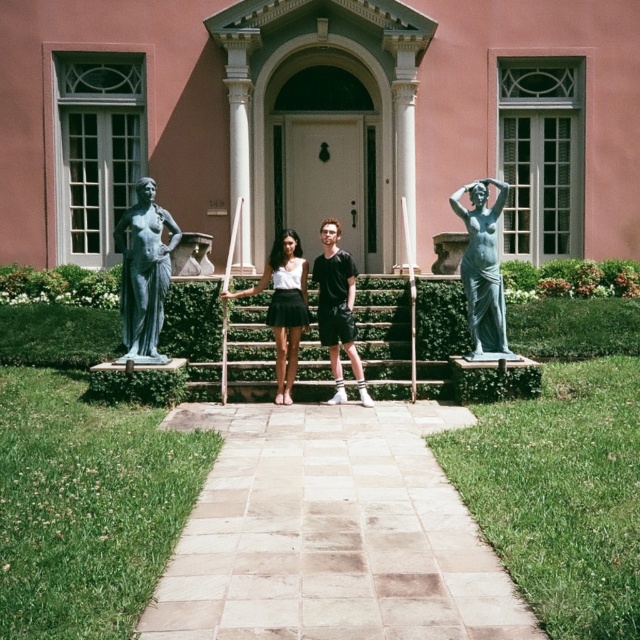
Question: Which point is closer to the camera?

Choices:
 (A) bronze statue at left
 (B) black matte shorts at center
 (C) matte green statue at right
 (D) matte white blouse at center

Answer: (A)

Question: Based on their relative distances, which object is nearer to the wooden stairs at center?

Choices:
 (A) bronze statue at left
 (B) matte green statue at right
 (C) white matte skirt at center

Answer: (B)

Question: Is the position of matte green statue at right more distant than that of white matte skirt at center?

Choices:
 (A) no
 (B) yes

Answer: (A)

Question: Which object is the closest to the black matte shorts at center?

Choices:
 (A) white matte skirt at center
 (B) matte white blouse at center
 (C) bronze statue at left
 (D) wooden stairs at center

Answer: (A)

Question: Can you confirm if bronze statue at left is smaller than matte white blouse at center?

Choices:
 (A) no
 (B) yes

Answer: (A)

Question: Does bronze statue at left appear on the left side of matte green statue at right?

Choices:
 (A) yes
 (B) no

Answer: (A)